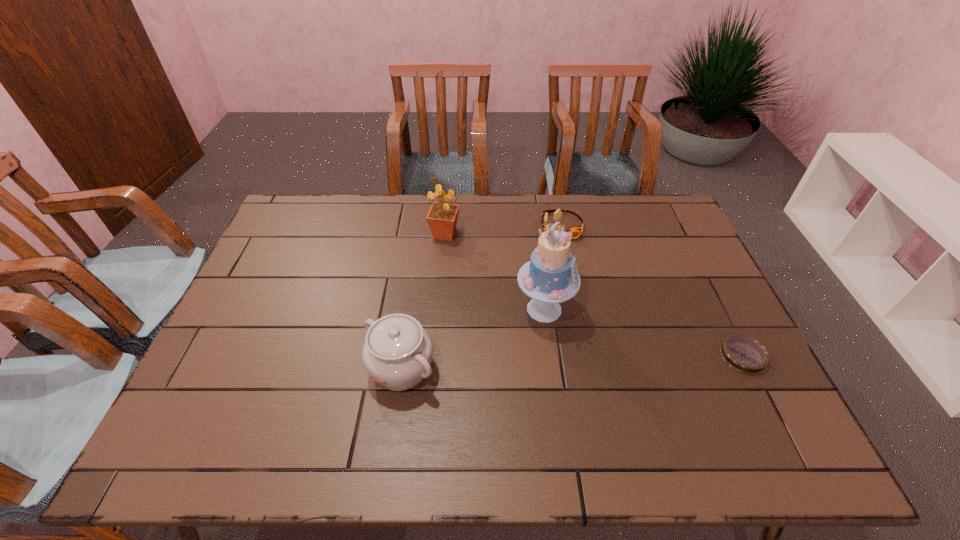
Identify the location of object located at the near edge. The width and height of the screenshot is (960, 540). (397, 353).

Locate an element on the screen. The width and height of the screenshot is (960, 540). object that is positioned at the right edge is located at coordinates (744, 354).

Identify the location of vacant space at the far edge. (477, 224).

The image size is (960, 540). Identify the location of vacant space at the near edge of the desktop. (666, 413).

In order to click on free region at the left edge of the desktop in this screenshot , I will do `click(276, 314)`.

I want to click on free spot at the far left corner of the desktop, so click(x=286, y=219).

In the image, there is a desktop. Where is `vacant region at the far right corner`? Image resolution: width=960 pixels, height=540 pixels. vacant region at the far right corner is located at coordinates click(658, 204).

Where is `empty space that is in between the chinaware and the third nearest object`? This screenshot has width=960, height=540. empty space that is in between the chinaware and the third nearest object is located at coordinates (472, 339).

Identify the location of vacant space that is in between the second tallest object and the third nearest object. (495, 272).

Identify the location of vacant space that is in between the second tallest object and the fourth tallest object. This screenshot has width=960, height=540. (504, 230).